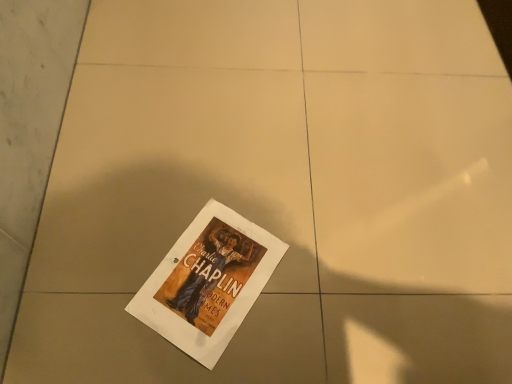
Locate an element on the screen. white paper poster at center is located at coordinates (208, 282).

Measure the distance between point (215, 249) and camera.

A distance of 35.71 inches exists between point (215, 249) and camera.

This screenshot has width=512, height=384. What do you see at coordinates (208, 282) in the screenshot?
I see `white paper poster at center` at bounding box center [208, 282].

Identify the location of white paper poster at center. The width and height of the screenshot is (512, 384). (208, 282).